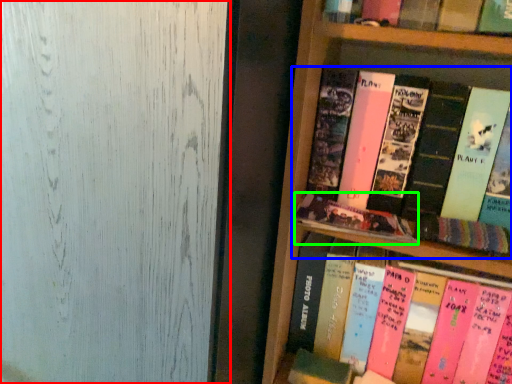
Question: Which object is positioned closest to glass door (highlighted by a red box)? Select from book (highlighted by a blue box) and book (highlighted by a green box).

Choices:
 (A) book
 (B) book

Answer: (B)